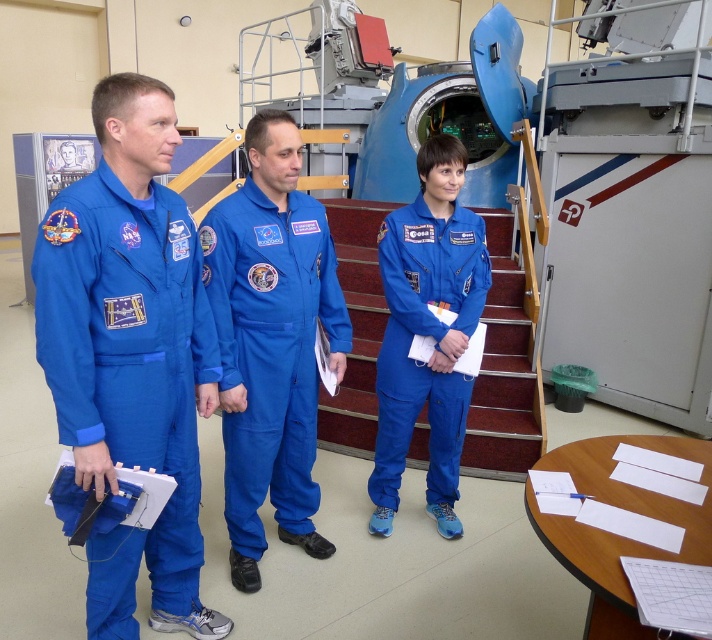
You are an astronaut in the facility and need to quickly locate your two teammates wearing the matte blue jumpsuit at left and the blue fabric jumpsuit at center. From your current position facing the equipment, which teammate is positioned to your left?

The matte blue jumpsuit at left is positioned to your left since it is located to the left of the blue fabric jumpsuit at center.

In the scene shown: You are standing in the room with the three astronauts and the spacecraft simulator. You want to reach the point marked at coordinates point (197, 509). The point is 6.72 feet away from you. If you take three steps forward, each step covering 2 feet, will you reach the point?

The point (197, 509) is 6.72 feet away. Taking three steps of 2 feet each covers 6 feet. Since 6 feet is less than 6.72 feet, you will not reach the point.

You are an astronaut preparing for a mission and need to choose between the blue smooth jumpsuit at center and the blue fabric jumpsuit at center. Which one is bigger?

The blue smooth jumpsuit at center is larger in size than the blue fabric jumpsuit at center.